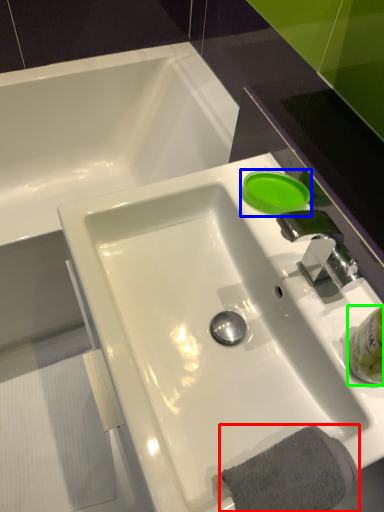
Question: Estimate the real-world distances between objects in this image. Which object is farther from bath towel (highlighted by a red box), liquid (highlighted by a blue box) or liquid (highlighted by a green box)?

Choices:
 (A) liquid
 (B) liquid

Answer: (A)